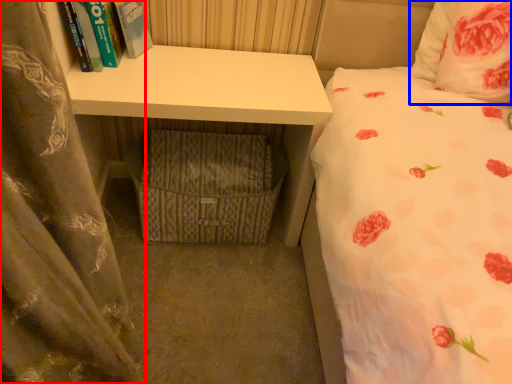
Question: Among these objects, which one is nearest to the camera, curtain (highlighted by a red box) or pillow (highlighted by a blue box)?

Choices:
 (A) curtain
 (B) pillow

Answer: (A)